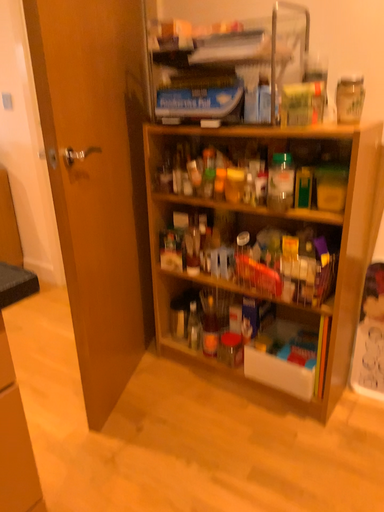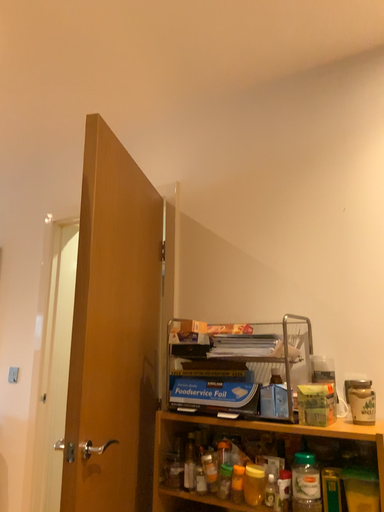
Question: How did the camera likely rotate when shooting the video?

Choices:
 (A) rotated downward
 (B) rotated upward

Answer: (B)